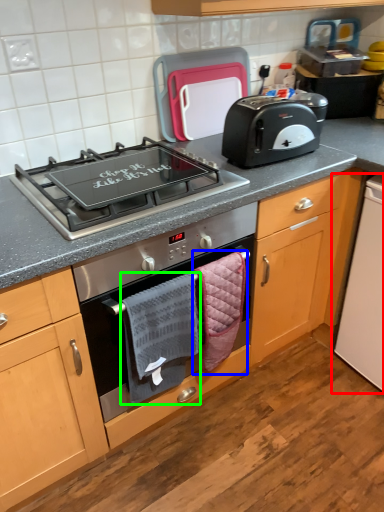
Question: Which is nearer to the appliance (highlighted by a red box)? hand towel (highlighted by a blue box) or hand towel (highlighted by a green box).

Choices:
 (A) hand towel
 (B) hand towel

Answer: (A)